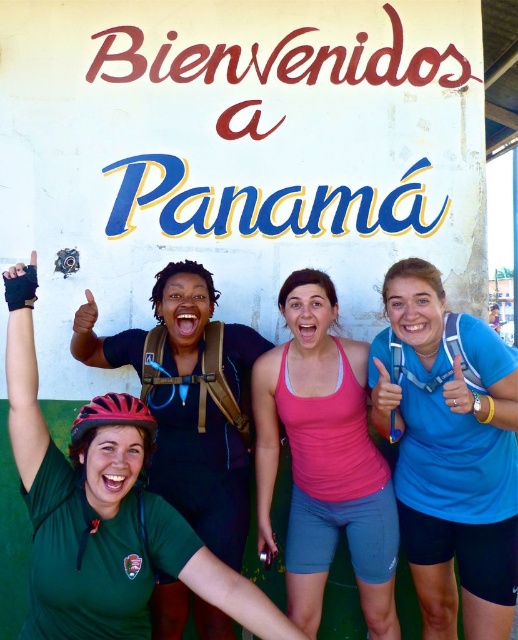
You are a photographer trying to capture a group photo of the blue fabric shirt at center and the matte black helmet at lower left. The minimum distance required for your camera to focus clearly is 3 feet. Can you take a clear photo of both subjects at the same time?

The blue fabric shirt at center and the matte black helmet at lower left are 3.48 feet apart, which is greater than the minimum 3 feet required for clear focus. Therefore, the photographer can take a clear photo of both subjects simultaneously.

You are a photographer trying to capture a photo of the pink fabric tank top at center and the red matte bicycle helmet at lower left. Since you want to focus on the tank top, which object should you zoom in on more and why?

You should zoom in more on the pink fabric tank top at center because it has a greater height compared to the red matte bicycle helmet at lower left, making it a larger subject to emphasize.